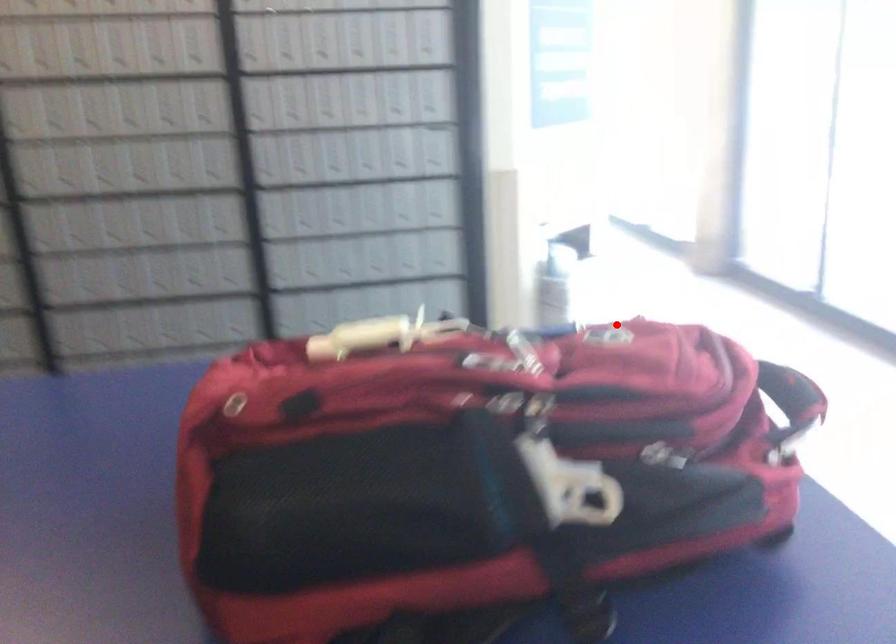
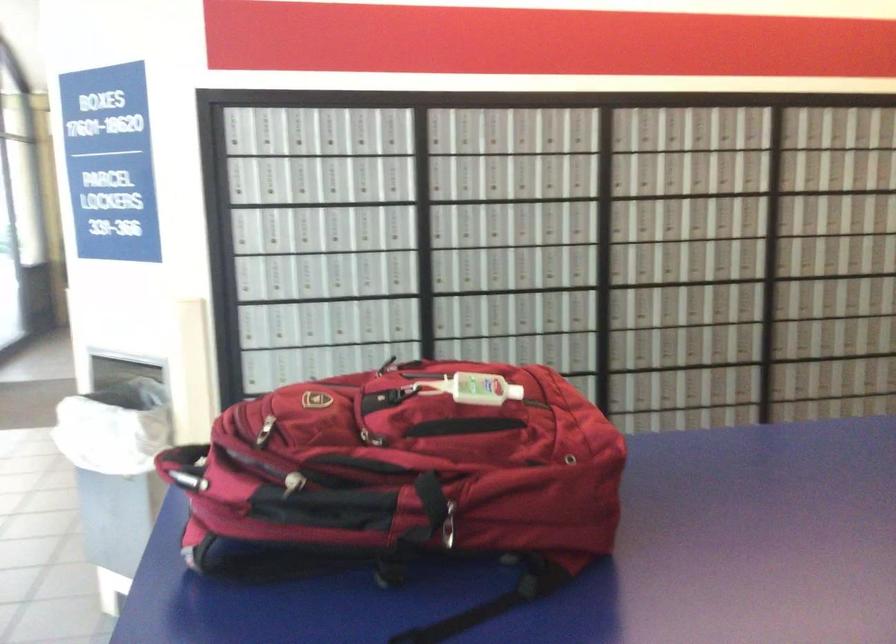
Question: I am providing you with two images of the same scene from different viewpoints. Given a red point in image1, look at the same physical point in image2. Is it:

Choices:
 (A) Closer to the viewpoint
 (B) Farther from the viewpoint

Answer: (B)